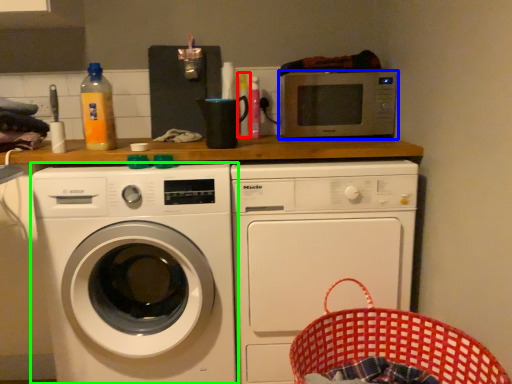
Question: Which object is the farthest from bottle (highlighted by a red box)? Choose among these: microwave oven (highlighted by a blue box) or washing machine (highlighted by a green box).

Choices:
 (A) microwave oven
 (B) washing machine

Answer: (B)